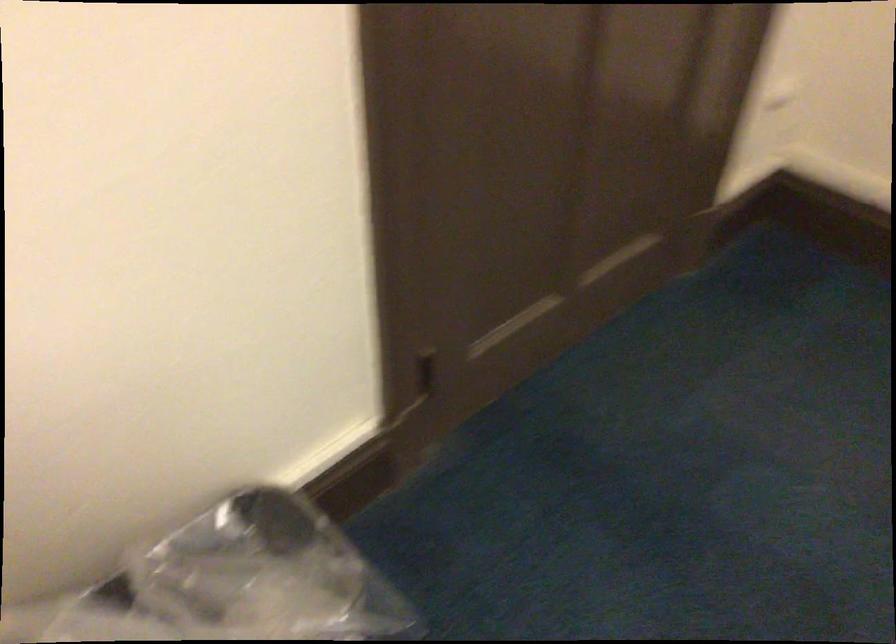
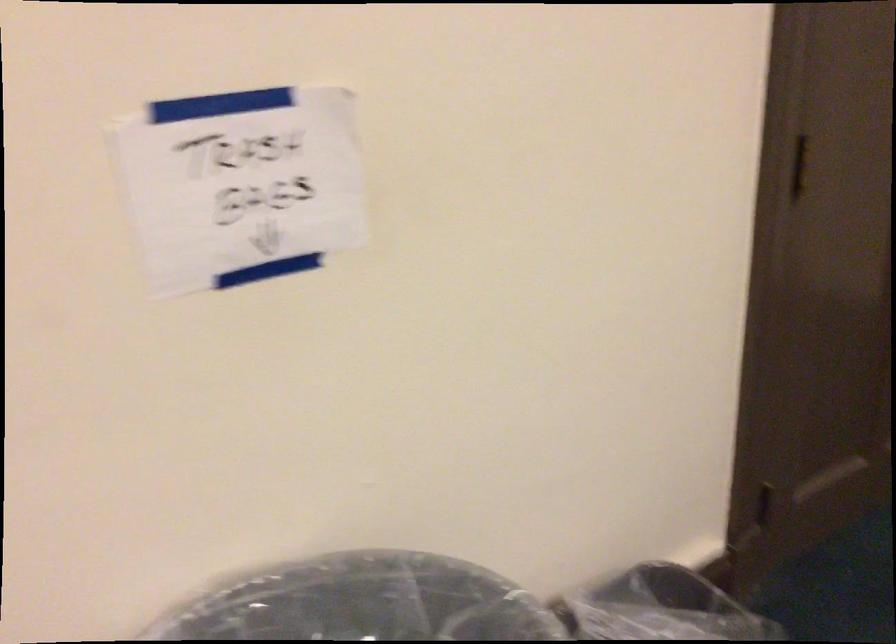
The images are taken continuously from a first-person perspective. In which direction are you moving?

The cameraman walked toward left, backward.